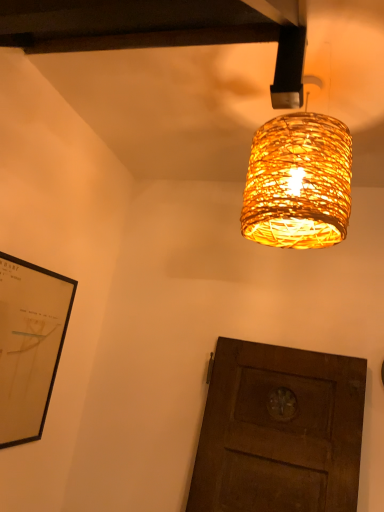
Locate an element on the screen. The height and width of the screenshot is (512, 384). woven bamboo lampshade at upper center is located at coordinates (298, 182).

Consider the image. Measure the distance between woven bamboo lampshade at upper center and camera.

They are 1.04 meters apart.

The height and width of the screenshot is (512, 384). Describe the element at coordinates (298, 182) in the screenshot. I see `woven bamboo lampshade at upper center` at that location.

What is the approximate height of woven bamboo lampshade at upper center?

woven bamboo lampshade at upper center is 19.78 inches in height.

Find the location of `woven bamboo lampshade at upper center`. woven bamboo lampshade at upper center is located at coordinates (298, 182).